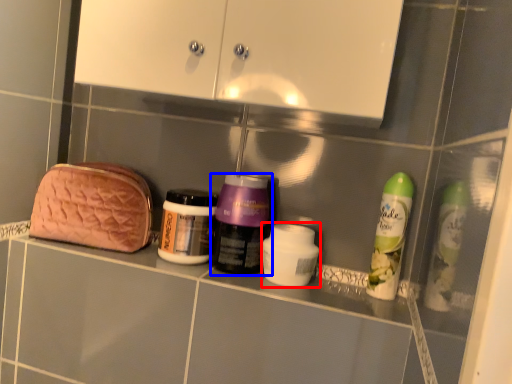
Question: Which object appears farthest to the camera in this image, toiletry (highlighted by a red box) or bottle (highlighted by a blue box)?

Choices:
 (A) toiletry
 (B) bottle

Answer: (B)